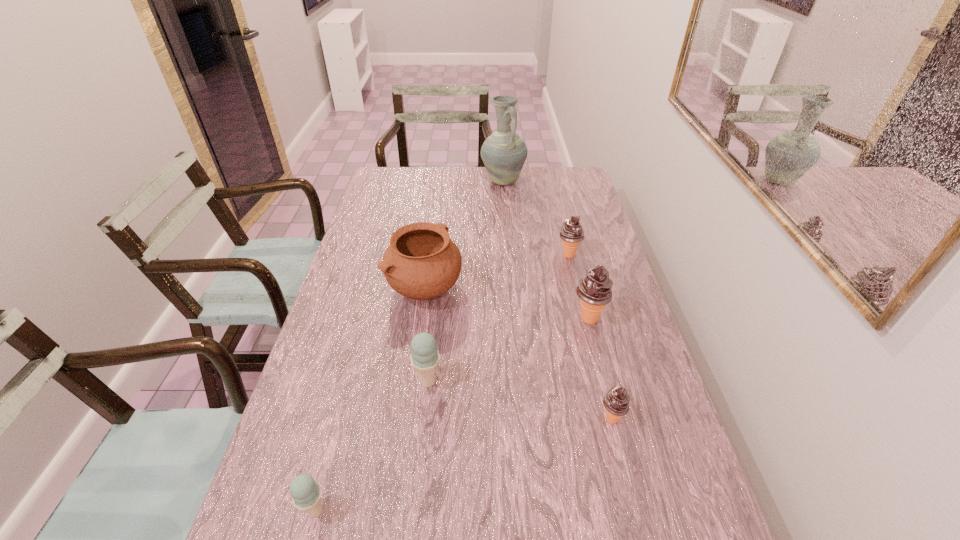
This screenshot has width=960, height=540. In order to click on the second nearest object in this screenshot , I will do `click(616, 401)`.

Image resolution: width=960 pixels, height=540 pixels. Find the location of `the leftmost object`. the leftmost object is located at coordinates (306, 493).

Where is `the smaller blue ice cream`? the smaller blue ice cream is located at coordinates (306, 493).

This screenshot has width=960, height=540. What are the coordinates of `free space located on the handle side of the pitcher` in the screenshot? It's located at (505, 210).

Where is `free location located on the front of the second nearest chocolate icecream`? This screenshot has width=960, height=540. free location located on the front of the second nearest chocolate icecream is located at coordinates (597, 354).

You are a GUI agent. You are given a task and a screenshot of the screen. Output one action in this format:
    pyautogui.click(x=<x>, y=<y>)
    Task: Click on the free region located 0.270m on the right of the terracotta pottery
    The width and height of the screenshot is (960, 540).
    Given the screenshot: What is the action you would take?
    pyautogui.click(x=549, y=288)

This screenshot has height=540, width=960. What are the coordinates of `vacant space situated on the left of the second farthest object` in the screenshot? It's located at (484, 255).

Find the location of a particular element. free space located 0.180m on the back of the third nearest ice cream is located at coordinates (435, 319).

Where is `vacant space located 0.070m on the left of the sixth farthest object`? Image resolution: width=960 pixels, height=540 pixels. vacant space located 0.070m on the left of the sixth farthest object is located at coordinates (569, 419).

Find the location of a particular element. The image size is (960, 540). free space located 0.070m on the left of the smaller blue ice cream is located at coordinates (267, 510).